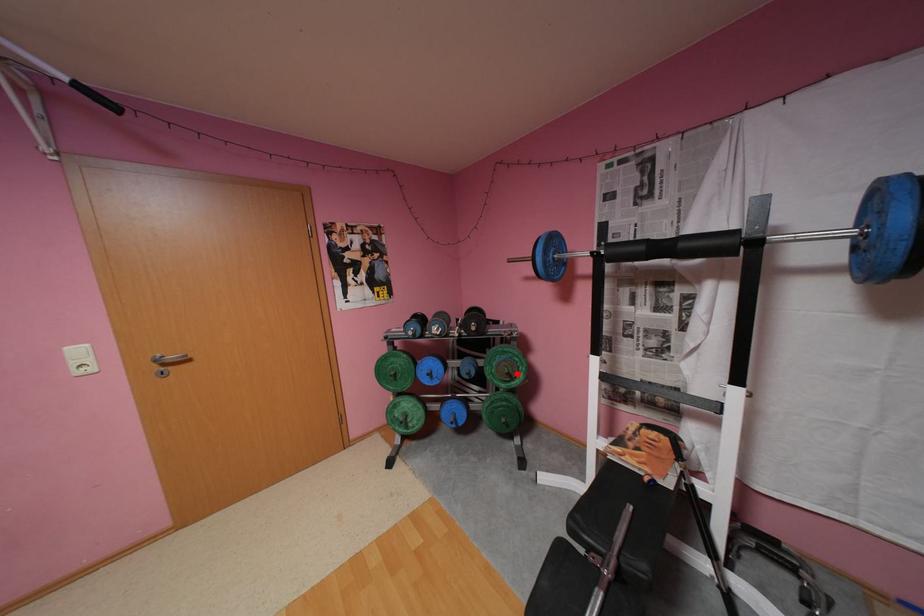
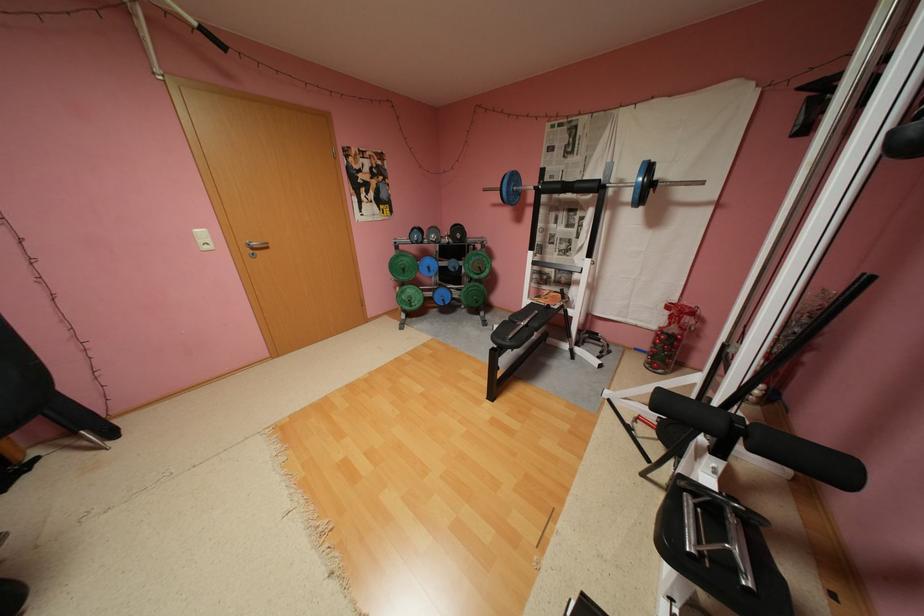
Question: I am providing you with two images of the same scene from different viewpoints. Given a red point in image1, look at the same physical point in image2. Is it:

Choices:
 (A) Closer to the viewpoint
 (B) Farther from the viewpoint

Answer: (A)